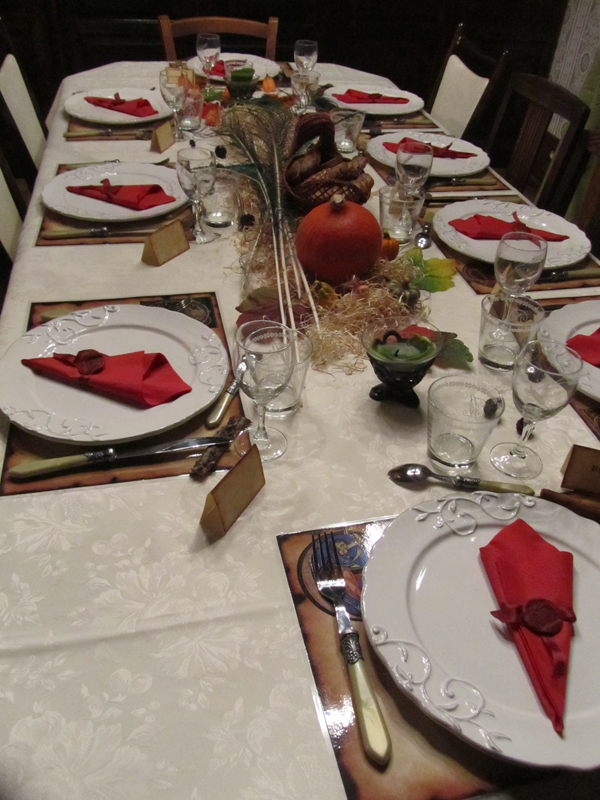
At what (x,y) coordinates should I click in order to perform the action: click on placemats. Please return your answer as a coordinate pair (x, y). Image resolution: width=600 pixels, height=800 pixels. Looking at the image, I should click on (420, 774), (120, 470), (588, 414), (479, 280), (501, 186), (91, 238), (78, 126), (422, 116), (288, 66).